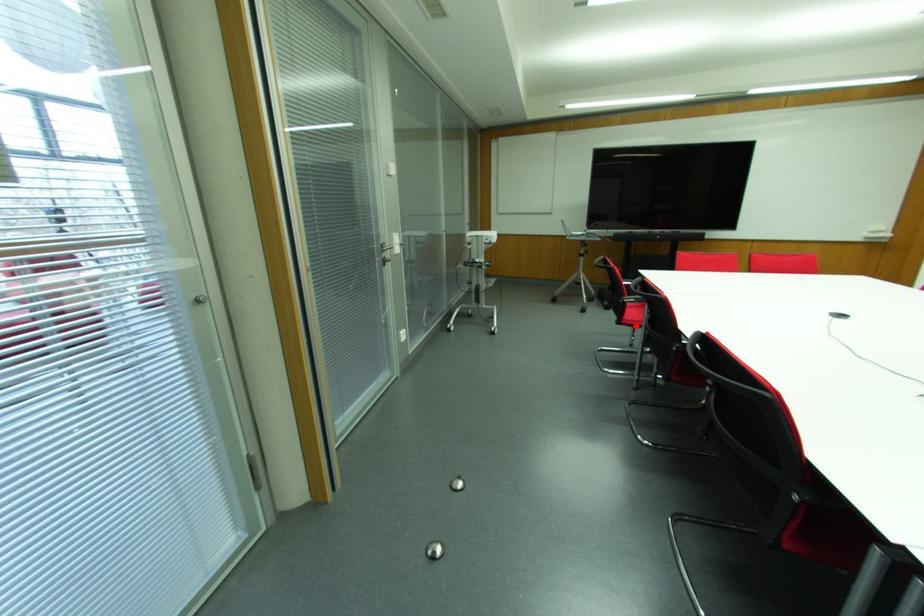
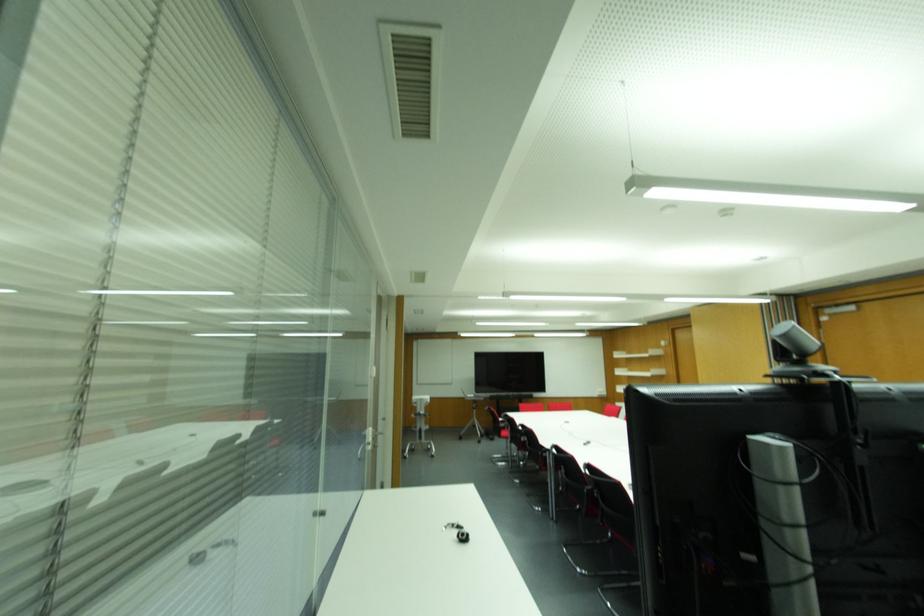
Where in the second image is the point corresponding to the highlighted location from the first image?

(505, 438)